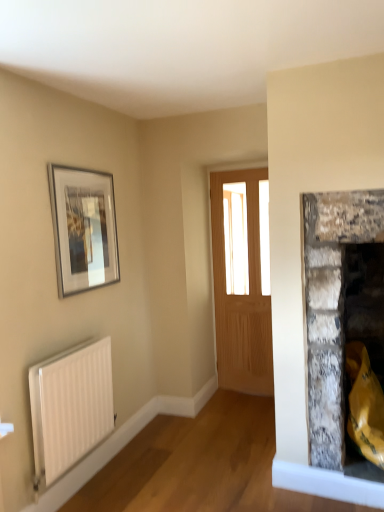
Question: Is light brown wooden door at center smaller than silver metallic picture frame at upper left?

Choices:
 (A) no
 (B) yes

Answer: (A)

Question: Are light brown wooden door at center and silver metallic picture frame at upper left far apart?

Choices:
 (A) no
 (B) yes

Answer: (B)

Question: From the image's perspective, is light brown wooden door at center beneath silver metallic picture frame at upper left?

Choices:
 (A) yes
 (B) no

Answer: (A)

Question: Is light brown wooden door at center surrounding silver metallic picture frame at upper left?

Choices:
 (A) no
 (B) yes

Answer: (A)

Question: Is light brown wooden door at center oriented towards silver metallic picture frame at upper left?

Choices:
 (A) yes
 (B) no

Answer: (B)

Question: Considering the positions of silver metallic picture frame at upper left and light brown wooden door at center in the image, is silver metallic picture frame at upper left bigger or smaller than light brown wooden door at center?

Choices:
 (A) small
 (B) big

Answer: (A)

Question: Does point (105, 226) appear closer or farther from the camera than point (268, 231)?

Choices:
 (A) farther
 (B) closer

Answer: (A)

Question: In terms of height, does silver metallic picture frame at upper left look taller or shorter compared to light brown wooden door at center?

Choices:
 (A) short
 (B) tall

Answer: (A)

Question: From the image's perspective, is silver metallic picture frame at upper left above or below light brown wooden door at center?

Choices:
 (A) below
 (B) above

Answer: (B)

Question: Is point (235, 257) positioned closer to the camera than point (107, 202)?

Choices:
 (A) farther
 (B) closer

Answer: (A)

Question: From the image's perspective, is light brown wooden door at center located above or below silver metallic picture frame at upper left?

Choices:
 (A) above
 (B) below

Answer: (B)

Question: Visually, is light brown wooden door at center positioned to the left or to the right of silver metallic picture frame at upper left?

Choices:
 (A) left
 (B) right

Answer: (B)

Question: From their relative heights in the image, would you say light brown wooden door at center is taller or shorter than silver metallic picture frame at upper left?

Choices:
 (A) short
 (B) tall

Answer: (B)

Question: Is white matte radiator at lower left bigger or smaller than light brown wooden door at center?

Choices:
 (A) small
 (B) big

Answer: (A)

Question: Considering the positions of point (48, 472) and point (240, 367), is point (48, 472) closer or farther from the camera than point (240, 367)?

Choices:
 (A) closer
 (B) farther

Answer: (A)